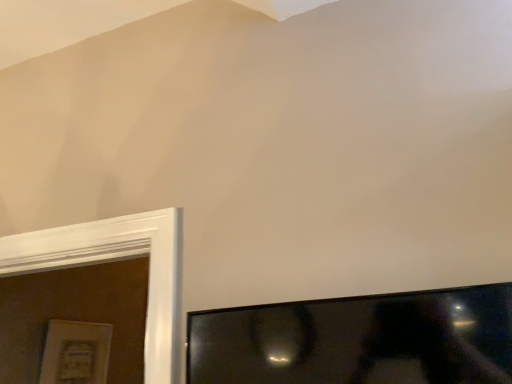
Question: Is point (56, 369) positioned closer to the camera than point (308, 314)?

Choices:
 (A) farther
 (B) closer

Answer: (A)

Question: In terms of height, does matte white picture frame at lower left look taller or shorter compared to black glossy tv at lower right?

Choices:
 (A) short
 (B) tall

Answer: (B)

Question: Is matte white picture frame at lower left bigger or smaller than black glossy tv at lower right?

Choices:
 (A) big
 (B) small

Answer: (B)

Question: Considering the positions of point (420, 301) and point (59, 380), is point (420, 301) closer or farther from the camera than point (59, 380)?

Choices:
 (A) farther
 (B) closer

Answer: (B)

Question: Is black glossy tv at lower right inside or outside of matte white picture frame at lower left?

Choices:
 (A) outside
 (B) inside

Answer: (A)

Question: From the image's perspective, relative to matte white picture frame at lower left, is black glossy tv at lower right above or below?

Choices:
 (A) above
 (B) below

Answer: (A)

Question: Is black glossy tv at lower right wider or thinner than matte white picture frame at lower left?

Choices:
 (A) thin
 (B) wide

Answer: (B)